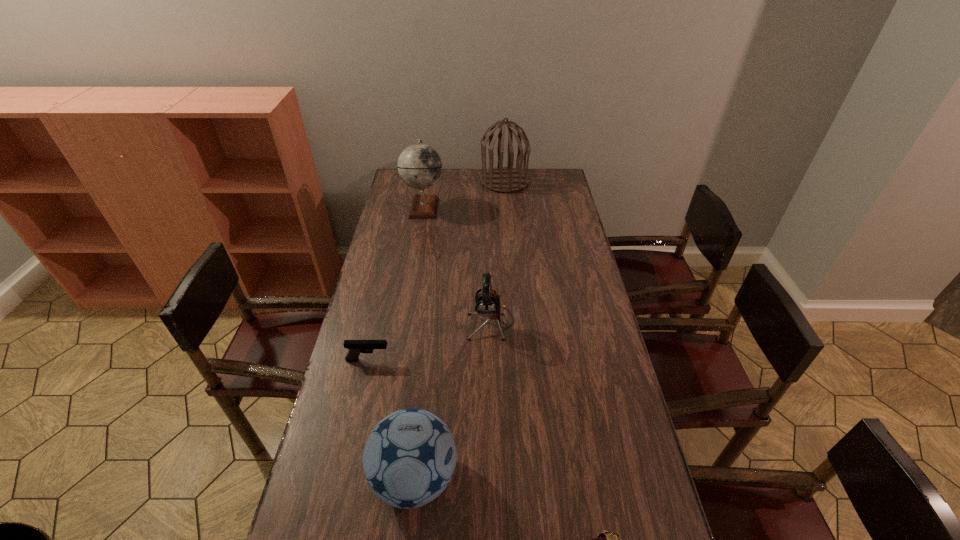
Locate an element on the screen. The image size is (960, 540). birdcage is located at coordinates (501, 179).

Image resolution: width=960 pixels, height=540 pixels. I want to click on globe, so click(419, 165).

Where is `the third farthest object`? Image resolution: width=960 pixels, height=540 pixels. the third farthest object is located at coordinates (487, 302).

Locate an element on the screen. the second nearest object is located at coordinates pos(409,458).

Identify the location of the third nearest object. The image size is (960, 540). (355, 347).

The width and height of the screenshot is (960, 540). In order to click on free space located 0.180m on the left of the farthest object in this screenshot , I will do `click(445, 181)`.

You are a GUI agent. You are given a task and a screenshot of the screen. Output one action in this format:
    pyautogui.click(x=<x>, y=<y>)
    Task: Click on the vacant space situated at the equator of the second farthest object
    Image resolution: width=960 pixels, height=540 pixels.
    Given the screenshot: What is the action you would take?
    pyautogui.click(x=481, y=207)

Where is `vacant space positioned on the front of the earphone`? The image size is (960, 540). vacant space positioned on the front of the earphone is located at coordinates (493, 425).

Where is `free spot located 0.260m on the side with brand of the soccer ball`? free spot located 0.260m on the side with brand of the soccer ball is located at coordinates (558, 478).

Where is `vacant region located 0.360m on the front-facing side of the pistol`? vacant region located 0.360m on the front-facing side of the pistol is located at coordinates (502, 360).